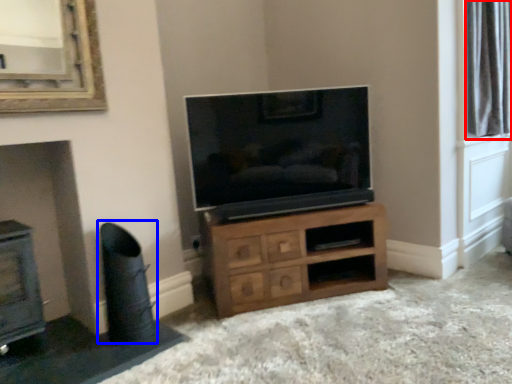
Question: Which object appears closest to the camera in this image, bay window (highlighted by a red box) or swivel chair (highlighted by a blue box)?

Choices:
 (A) bay window
 (B) swivel chair

Answer: (B)